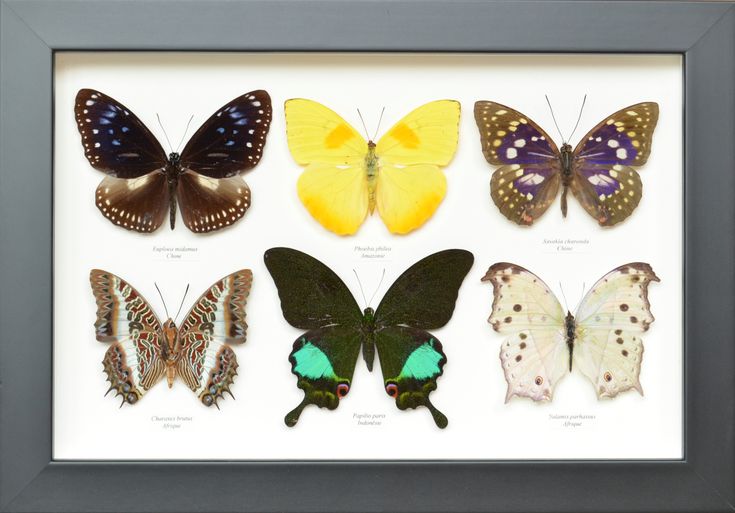
The width and height of the screenshot is (735, 513). In order to click on frame in this screenshot , I will do `click(345, 488)`, `click(359, 26)`, `click(15, 218)`, `click(713, 202)`.